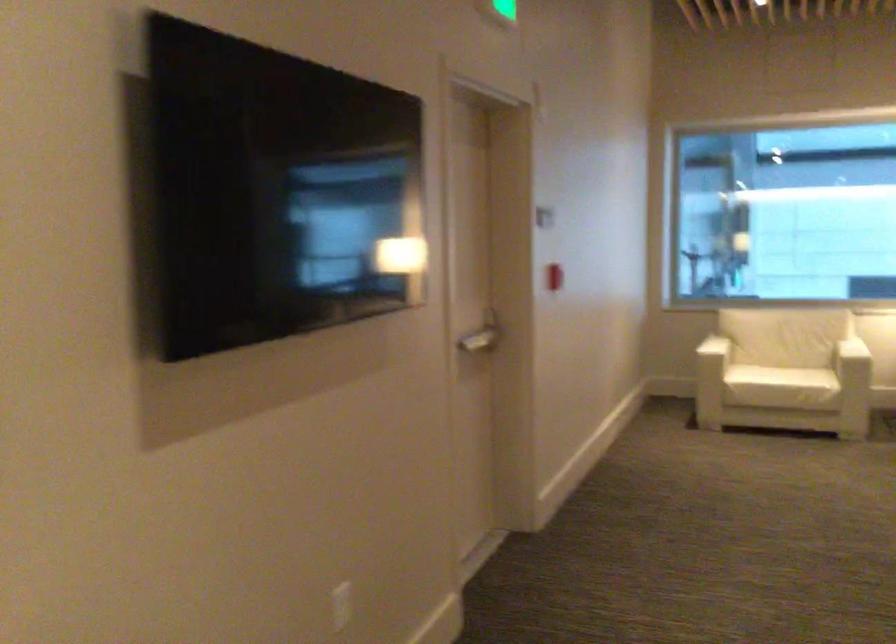
Where would you push the silver door handle? Please return your answer as a coordinate pair (x, y).

(478, 341)